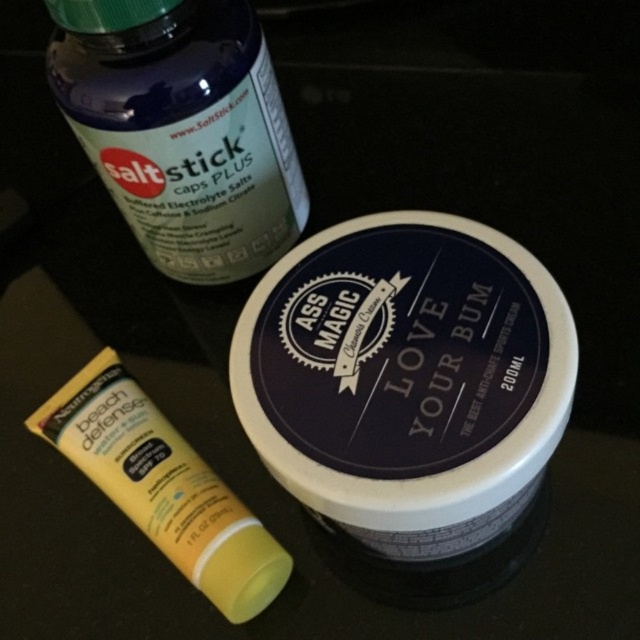
Does point (112, 145) lie behind point (208, 499)?

Yes, it is.

At what (x,y) coordinates should I click in order to perform the action: click on translucent plastic bottle at upper left. Please return your answer as a coordinate pair (x, y). This screenshot has width=640, height=640. Looking at the image, I should click on (182, 129).

Is point (445, 493) farther from camera compared to point (221, 241)?

No, (445, 493) is closer to viewer.

Between white matte jar at center and translucent plastic bottle at upper left, which one has more height?

Standing taller between the two is white matte jar at center.

Locate an element on the screen. white matte jar at center is located at coordinates (406, 378).

Is white matte jar at center smaller than yellow matte tube at lower left?

No.

Based on the photo, measure the distance between white matte jar at center and yellow matte tube at lower left.

The distance of white matte jar at center from yellow matte tube at lower left is 11.87 inches.

Is point (346, 307) in front of point (176, 545)?

Yes, it is in front of point (176, 545).

Locate an element on the screen. This screenshot has height=640, width=640. white matte jar at center is located at coordinates click(406, 378).